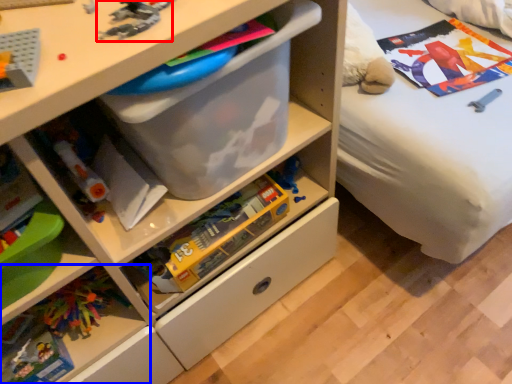
Question: Among these objects, which one is farthest to the camera, toy (highlighted by a red box) or shelf (highlighted by a blue box)?

Choices:
 (A) toy
 (B) shelf

Answer: (B)